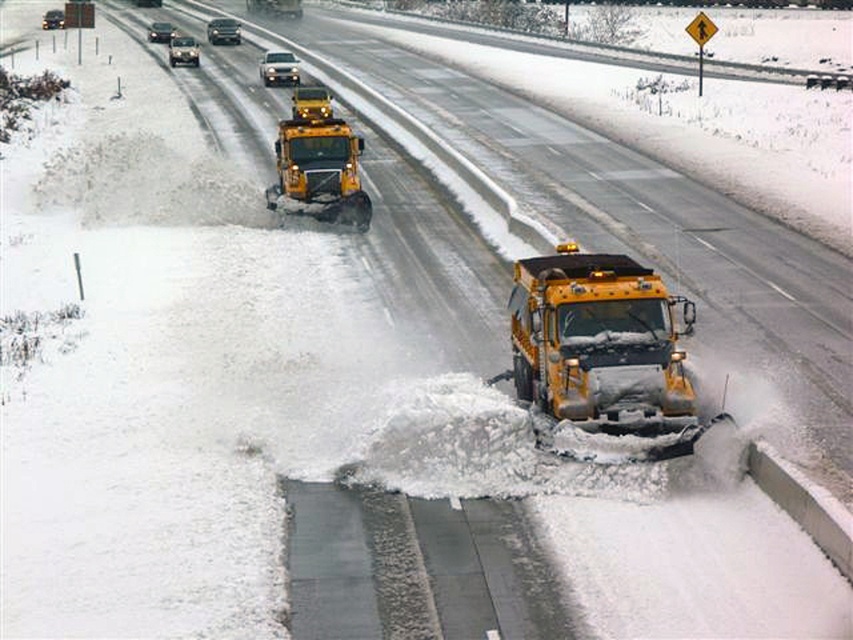
Can you confirm if yellow matte snowplow at center is shorter than shiny silver sedan at upper left?

Incorrect, yellow matte snowplow at center's height does not fall short of shiny silver sedan at upper left's.

Is point (616, 397) positioned in front of point (183, 51)?

Yes, it is.

Does point (660, 387) lie behind point (183, 38)?

No.

I want to click on yellow matte snowplow at center, so click(602, 348).

Who is positioned more to the right, yellow matte/snowplow at center or shiny silver sedan at upper left?

Positioned to the right is yellow matte/snowplow at center.

Can you confirm if yellow matte/snowplow at center is taller than shiny silver sedan at upper left?

Yes, yellow matte/snowplow at center is taller than shiny silver sedan at upper left.

This screenshot has height=640, width=853. Describe the element at coordinates (318, 161) in the screenshot. I see `yellow matte/snowplow at center` at that location.

This screenshot has height=640, width=853. In order to click on yellow matte/snowplow at center in this screenshot , I will do `click(318, 161)`.

Which is more to the right, yellow matte snowplow at center or shiny silver sedan at upper center?

From the viewer's perspective, yellow matte snowplow at center appears more on the right side.

Does yellow matte snowplow at center appear on the right side of shiny silver sedan at upper center?

Correct, you'll find yellow matte snowplow at center to the right of shiny silver sedan at upper center.

You are a GUI agent. You are given a task and a screenshot of the screen. Output one action in this format:
    pyautogui.click(x=<x>, y=<y>)
    Task: Click on the yellow matte snowplow at center
    
    Given the screenshot: What is the action you would take?
    pyautogui.click(x=602, y=348)